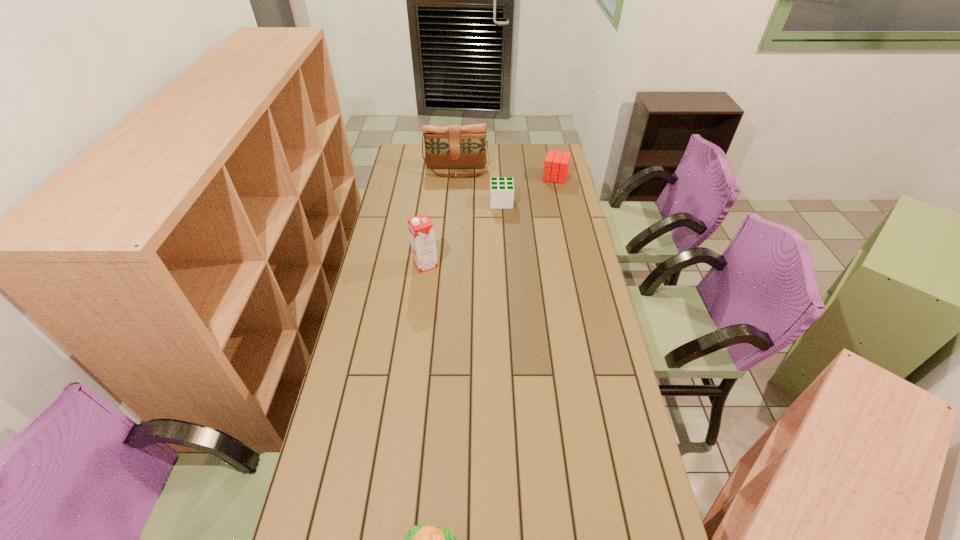
You are a GUI agent. You are given a task and a screenshot of the screen. Output one action in this format:
    pyautogui.click(x=<x>, y=<y>)
    Task: Click on the empty space that is in between the farther cube and the shoulder bag
    This screenshot has height=540, width=960.
    Given the screenshot: What is the action you would take?
    pyautogui.click(x=506, y=173)

Locate an element on the screen. vacant point located between the rightmost object and the carton is located at coordinates (491, 220).

This screenshot has width=960, height=540. Identify the location of empty space that is in between the shoulder bag and the left cube. (479, 186).

I want to click on free spot between the shoulder bag and the left cube, so click(x=479, y=186).

The image size is (960, 540). I want to click on empty space between the farther cube and the shoulder bag, so click(506, 173).

Find the location of a particular element. The image size is (960, 540). free space between the shoulder bag and the rightmost object is located at coordinates (506, 173).

Find the location of a particular element. vacant space in between the left cube and the shoulder bag is located at coordinates (479, 186).

Identify the location of the second closest object to the shoulder bag. (556, 164).

Point out which object is positioned as the fourth nearest to the second nearest object. Please provide its 2D coordinates. Your answer should be formatted as a tuple, i.e. [(x, y)], where the tuple contains the x and y coordinates of a point satisfying the conditions above.

[(424, 539)]

I want to click on free space that satisfies the following two spatial constraints: 1. on the front-facing side of the right cube; 2. on the right side of the shoulder bag, so (457, 177).